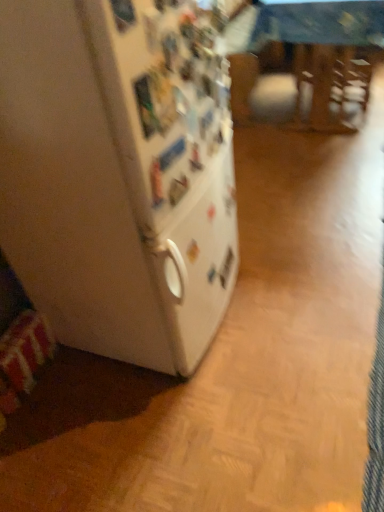
Locate an element on the screen. empty space that is to the right of white matte refrigerator at left is located at coordinates (291, 283).